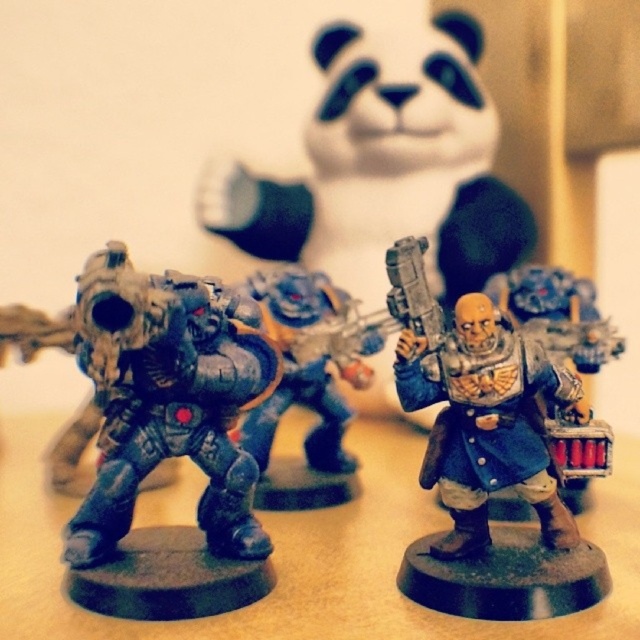
Is metallic blue figure at center smaller than matte black figure at center?

Incorrect, metallic blue figure at center is not smaller in size than matte black figure at center.

Is point (440, 76) farther from camera compared to point (544, 324)?

That is True.

Is point (312, 202) positioned before point (536, 316)?

No, (312, 202) is behind (536, 316).

Where is `metallic blue figure at center`? Image resolution: width=640 pixels, height=640 pixels. metallic blue figure at center is located at coordinates (385, 166).

Between point (349, 595) and point (312, 496), which one is positioned behind?

Positioned behind is point (312, 496).

Which is more to the right, matte black figurine at center or metallic blue power armor at center?

From the viewer's perspective, metallic blue power armor at center appears more on the right side.

Which is in front, point (605, 484) or point (356, 483)?

Point (356, 483) is in front.

I want to click on matte black figurine at center, so click(x=307, y=556).

Who is more distant from viewer, (506,465) or (310,296)?

The point (310,296) is more distant.

Which is above, matte blue armor at center or metallic blue power armor at center?

metallic blue power armor at center is higher up.

Who is more forward, [496,362] or [289,360]?

Positioned in front is point [496,362].

Locate an element on the screen. matte blue armor at center is located at coordinates (476, 404).